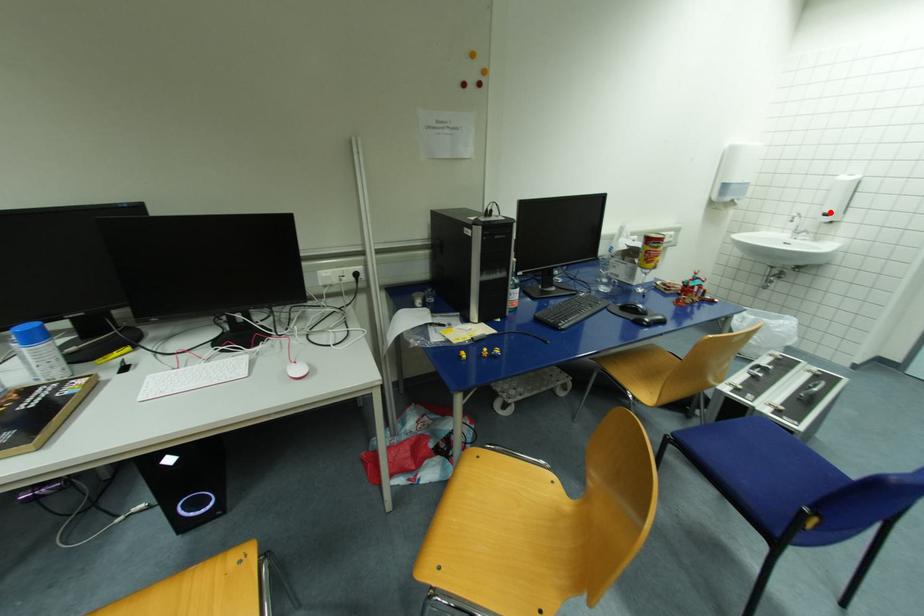
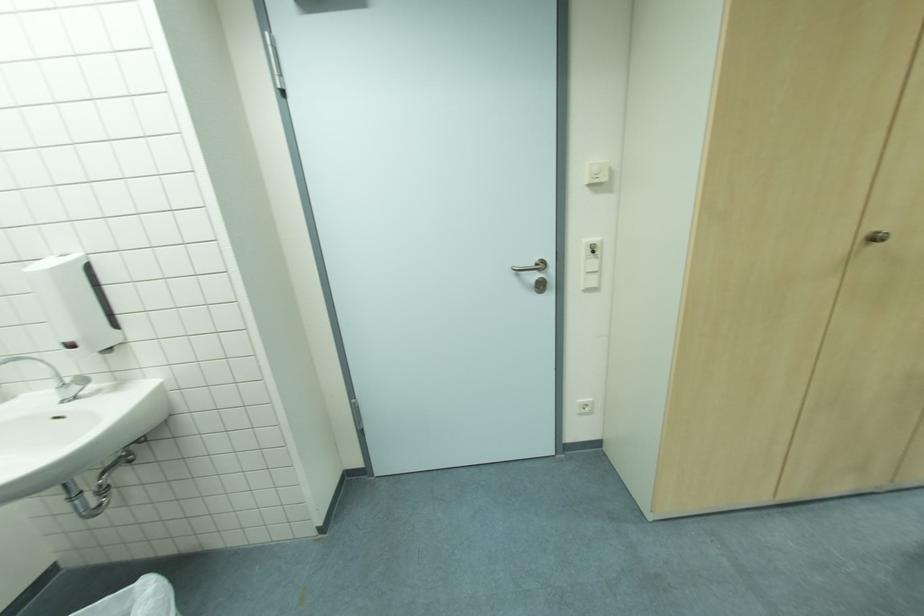
Question: I am providing you with two images of the same scene from different viewpoints. Given a red point in image1, look at the same physical point in image2. Is it:

Choices:
 (A) Closer to the viewpoint
 (B) Farther from the viewpoint

Answer: (A)